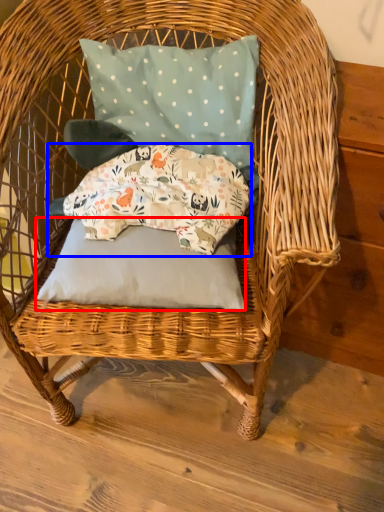
Question: Which object is further to the camera taking this photo, pillow (highlighted by a red box) or pillow (highlighted by a blue box)?

Choices:
 (A) pillow
 (B) pillow

Answer: (B)